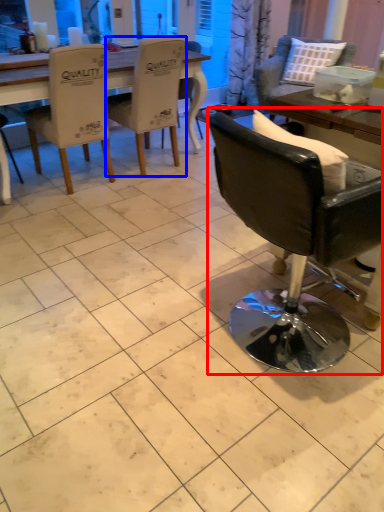
Question: Which of the following is the closest to the observer, chair (highlighted by a red box) or chair (highlighted by a blue box)?

Choices:
 (A) chair
 (B) chair

Answer: (A)